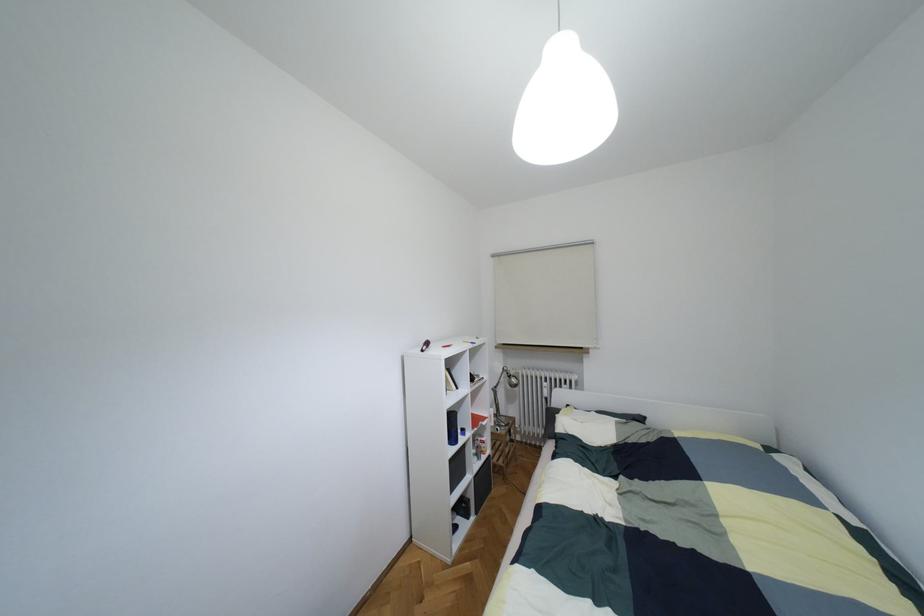
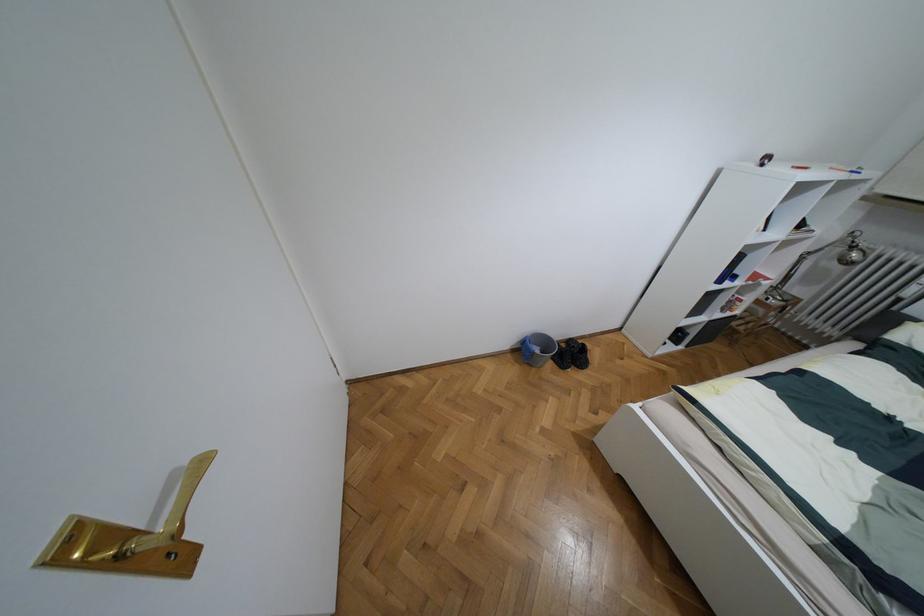
Locate, in the second image, the point that corresponds to point (508, 376) in the first image.

(852, 246)